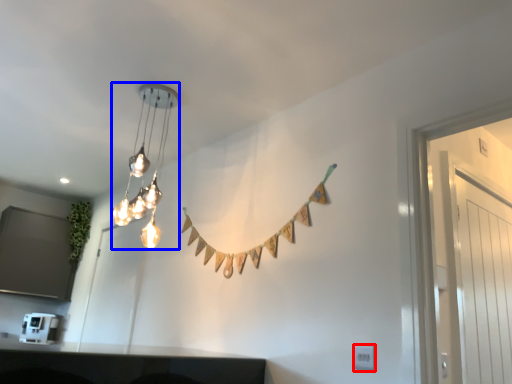
Question: Which object is closer to the camera taking this photo, electric outlet (highlighted by a red box) or lamp (highlighted by a blue box)?

Choices:
 (A) electric outlet
 (B) lamp

Answer: (A)